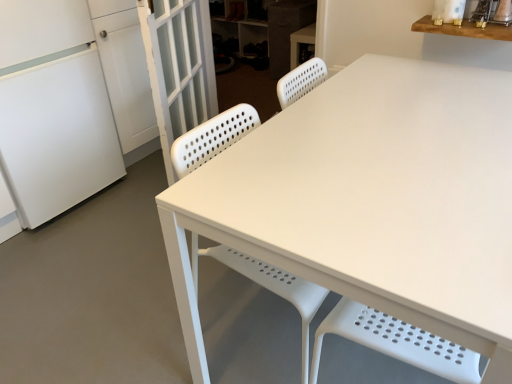
Question: Are white matte refrigerator at left and white textured screen door at left far apart?

Choices:
 (A) no
 (B) yes

Answer: (A)

Question: Is white matte refrigerator at left further to the viewer compared to white textured screen door at left?

Choices:
 (A) no
 (B) yes

Answer: (A)

Question: Considering the relative sizes of white matte refrigerator at left and white textured screen door at left in the image provided, is white matte refrigerator at left smaller than white textured screen door at left?

Choices:
 (A) no
 (B) yes

Answer: (A)

Question: Can you confirm if white matte refrigerator at left is taller than white textured screen door at left?

Choices:
 (A) yes
 (B) no

Answer: (A)

Question: From a real-world perspective, is white matte refrigerator at left under white textured screen door at left?

Choices:
 (A) yes
 (B) no

Answer: (B)

Question: Is white matte refrigerator at left looking in the opposite direction of white textured screen door at left?

Choices:
 (A) no
 (B) yes

Answer: (A)

Question: Is white matte refrigerator at left to the right of white matte cabinet at upper center, positioned as the 2th cabinetry in front-to-back order, from the viewer's perspective?

Choices:
 (A) no
 (B) yes

Answer: (A)

Question: Is white matte refrigerator at left looking in the opposite direction of white matte cabinet at upper center, positioned as the 2th cabinetry in front-to-back order?

Choices:
 (A) yes
 (B) no

Answer: (B)

Question: Is white matte refrigerator at left wider than white matte cabinet at upper center, the 1th cabinetry in the back-to-front sequence?

Choices:
 (A) yes
 (B) no

Answer: (A)

Question: Is white matte refrigerator at left with white matte cabinet at upper center, positioned as the 2th cabinetry in front-to-back order?

Choices:
 (A) no
 (B) yes

Answer: (A)

Question: From a real-world perspective, is white matte refrigerator at left beneath white matte cabinet at upper center, positioned as the 2th cabinetry in front-to-back order?

Choices:
 (A) yes
 (B) no

Answer: (B)

Question: Is white matte cabinet at upper center, the 1th cabinetry in the back-to-front sequence, completely or partially inside white matte refrigerator at left?

Choices:
 (A) yes
 (B) no

Answer: (B)

Question: Considering the relative positions of wooden shelf at upper right and white matte cabinet at upper center, the 1th cabinetry in the back-to-front sequence, in the image provided, is wooden shelf at upper right in front of white matte cabinet at upper center, the 1th cabinetry in the back-to-front sequence,?

Choices:
 (A) yes
 (B) no

Answer: (A)